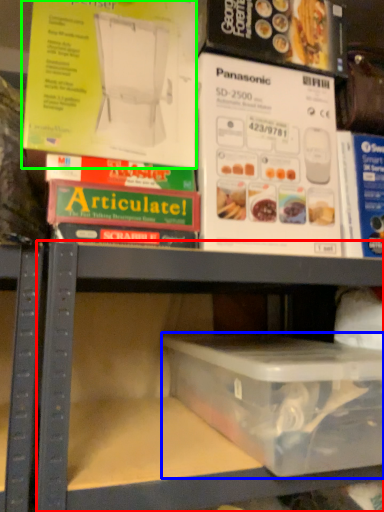
Question: Considering the real-world distances, which object is closest to shelf (highlighted by a red box)? box (highlighted by a blue box) or paperback book (highlighted by a green box).

Choices:
 (A) box
 (B) paperback book

Answer: (A)